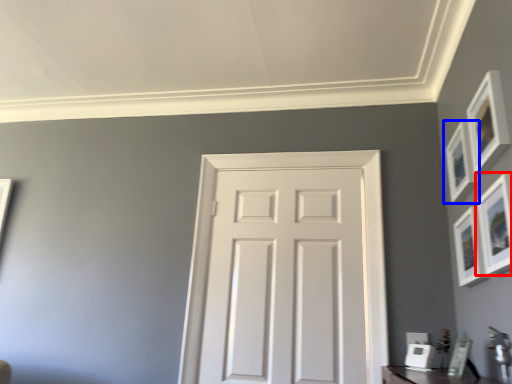
Question: Which of the following is the closest to the observer, picture frame (highlighted by a red box) or picture frame (highlighted by a blue box)?

Choices:
 (A) picture frame
 (B) picture frame

Answer: (A)